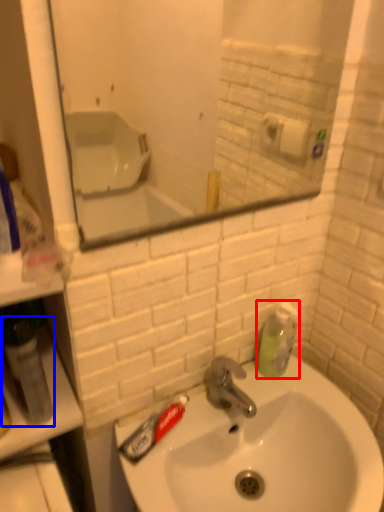
Question: Among these objects, which one is farthest to the camera, soap dispenser (highlighted by a red box) or mouthwash (highlighted by a blue box)?

Choices:
 (A) soap dispenser
 (B) mouthwash

Answer: (A)